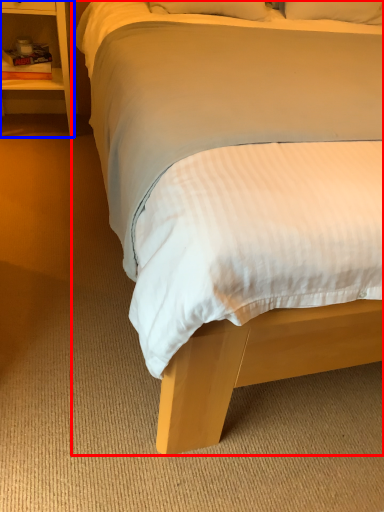
Question: Which point is further to the camera, bed (highlighted by a red box) or nightstand (highlighted by a blue box)?

Choices:
 (A) bed
 (B) nightstand

Answer: (B)